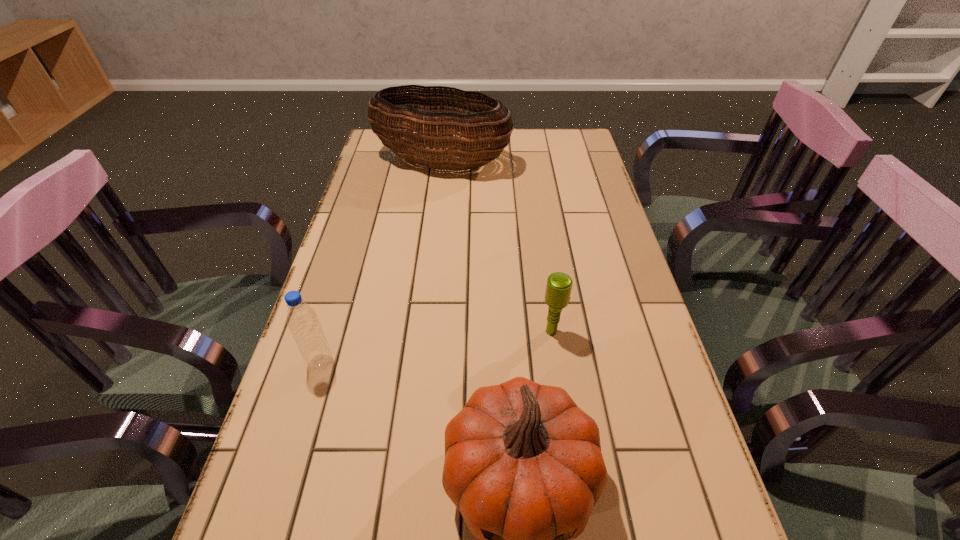
Locate an element on the screen. vacant space that satisfies the following two spatial constraints: 1. on the front side of the shortest object; 2. on the right side of the basket is located at coordinates (422, 332).